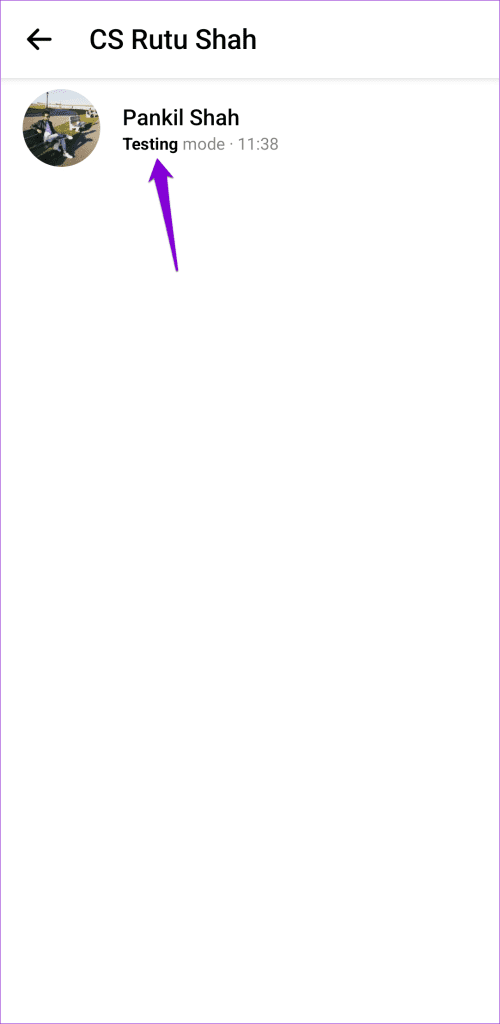
This screenshot has height=1024, width=500. I want to click on benches, so click(78, 125), click(39, 143).